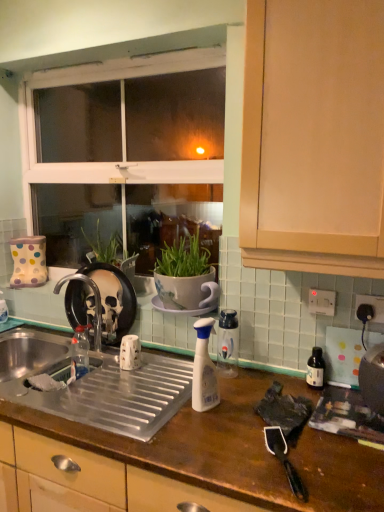
Question: Could you tell me if transparent plastic spray bottle at center, which is counted as the 2th bottle, starting from the back, is turned towards black glass bottle at right, which is the third bottle in back-to-front order?

Choices:
 (A) yes
 (B) no

Answer: (B)

Question: From a real-world perspective, is transparent plastic spray bottle at center, the second bottle positioned from the right, located beneath black glass bottle at right, which is the third bottle in back-to-front order?

Choices:
 (A) yes
 (B) no

Answer: (B)

Question: Does transparent plastic spray bottle at center, the second bottle positioned from the right, have a lesser height compared to black glass bottle at right, which is the third bottle in back-to-front order?

Choices:
 (A) yes
 (B) no

Answer: (B)

Question: Is transparent plastic spray bottle at center, which is the 3th bottle from left to right, smaller than black glass bottle at right, which is the third bottle in back-to-front order?

Choices:
 (A) no
 (B) yes

Answer: (A)

Question: From a real-world perspective, is transparent plastic spray bottle at center, the second bottle positioned from the right, located higher than black glass bottle at right, the 4th bottle from the left?

Choices:
 (A) no
 (B) yes

Answer: (B)

Question: Would you say transparent plastic spray bottle at center, the second bottle positioned from the right, contains black glass bottle at right, which is the third bottle in back-to-front order?

Choices:
 (A) no
 (B) yes

Answer: (A)

Question: Is black glass bottle at right, which appears as the 1th bottle when viewed from the right, not close to brown wooden countertop at center?

Choices:
 (A) yes
 (B) no

Answer: (B)

Question: Is black glass bottle at right, marked as the 2th bottle in a front-to-back arrangement, surrounding brown wooden countertop at center?

Choices:
 (A) yes
 (B) no

Answer: (B)

Question: Can you confirm if black glass bottle at right, marked as the 2th bottle in a front-to-back arrangement, is smaller than brown wooden countertop at center?

Choices:
 (A) yes
 (B) no

Answer: (A)

Question: Is black glass bottle at right, which is the third bottle in back-to-front order, aimed at brown wooden countertop at center?

Choices:
 (A) no
 (B) yes

Answer: (A)

Question: Does black glass bottle at right, the 4th bottle from the left, have a greater width compared to brown wooden countertop at center?

Choices:
 (A) yes
 (B) no

Answer: (B)

Question: Is black glass bottle at right, the 4th bottle from the left, to the right of brown wooden countertop at center from the viewer's perspective?

Choices:
 (A) yes
 (B) no

Answer: (A)

Question: Does brown wooden countertop at center have a greater height compared to white plastic spray bottle at center, placed as the first bottle when sorted from front to back?

Choices:
 (A) no
 (B) yes

Answer: (B)